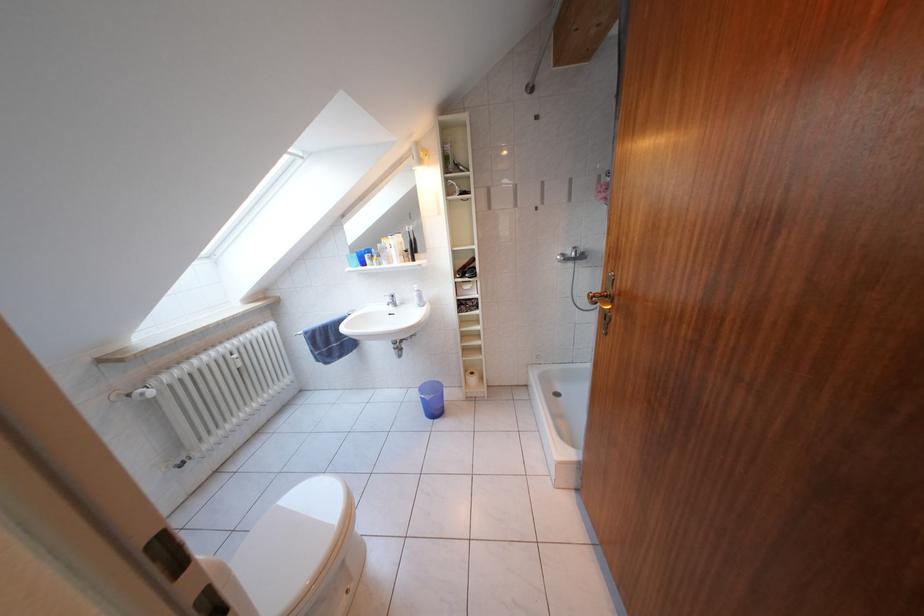
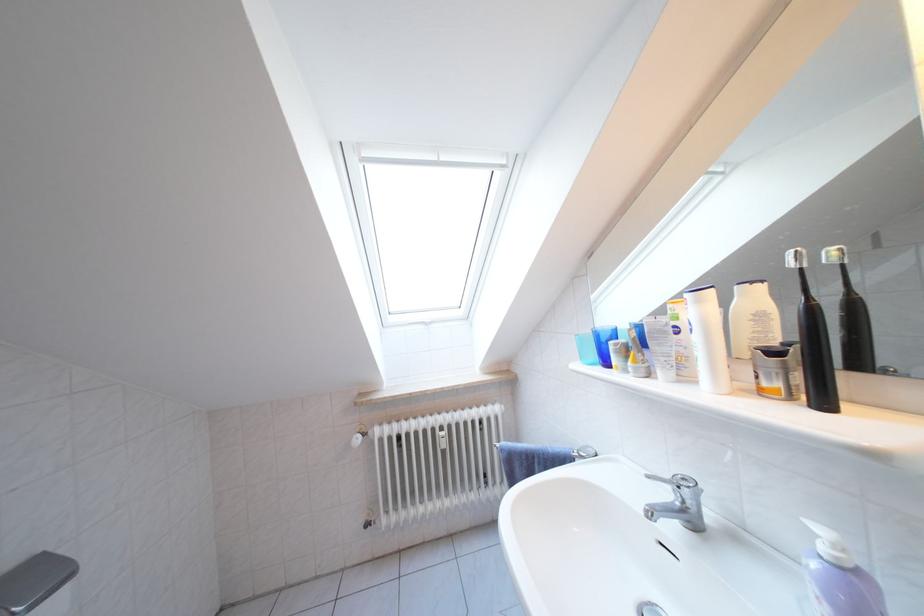
Find the pixel in the second image that matches point (397, 305) in the first image.

(675, 500)